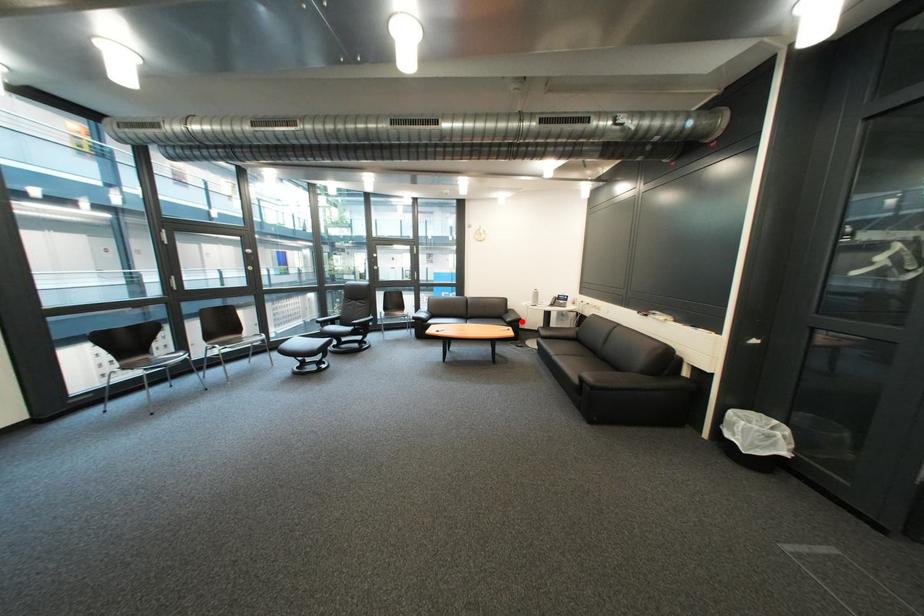
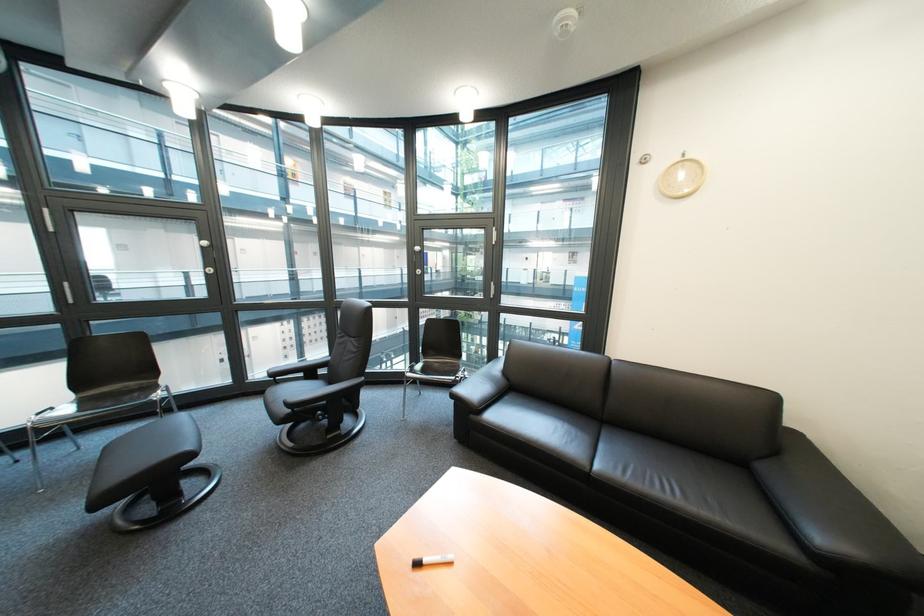
Question: I am providing you with two images of the same scene from different viewpoints. A red point is shown in image1. For the corresponding object point in image2, is it positioned nearer or farther from the camera?

Choices:
 (A) Nearer
 (B) Farther

Answer: (A)